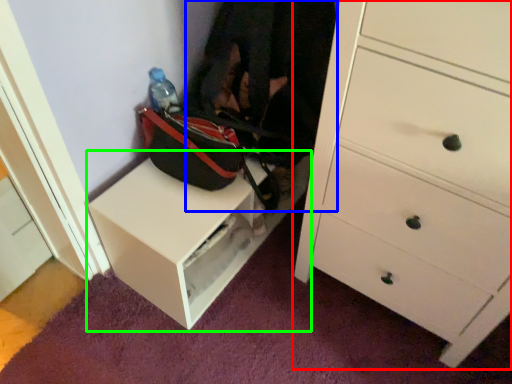
Question: Which object is positioned farthest from chest of drawers (highlighted by a red box)? Select from clothing (highlighted by a blue box) and table (highlighted by a green box).

Choices:
 (A) clothing
 (B) table

Answer: (B)